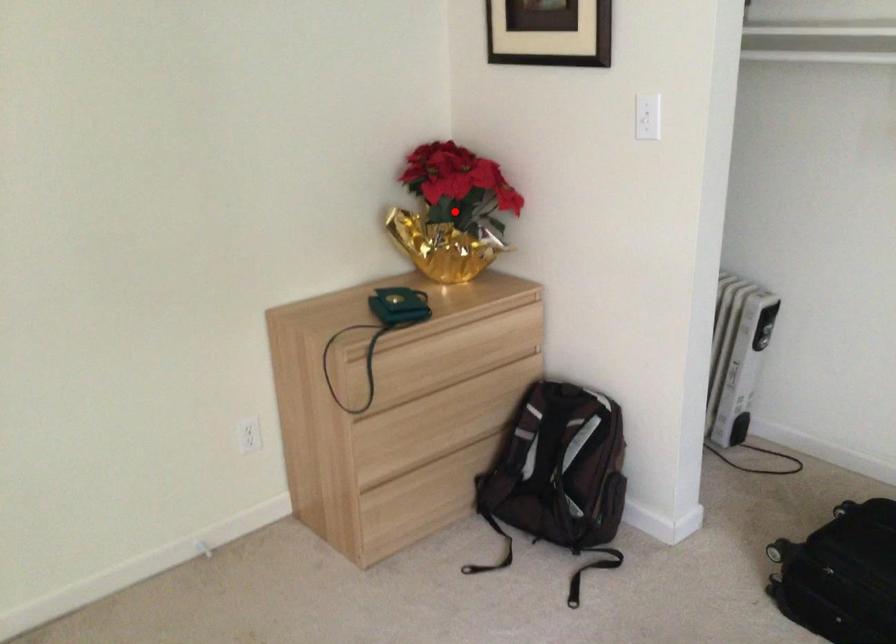
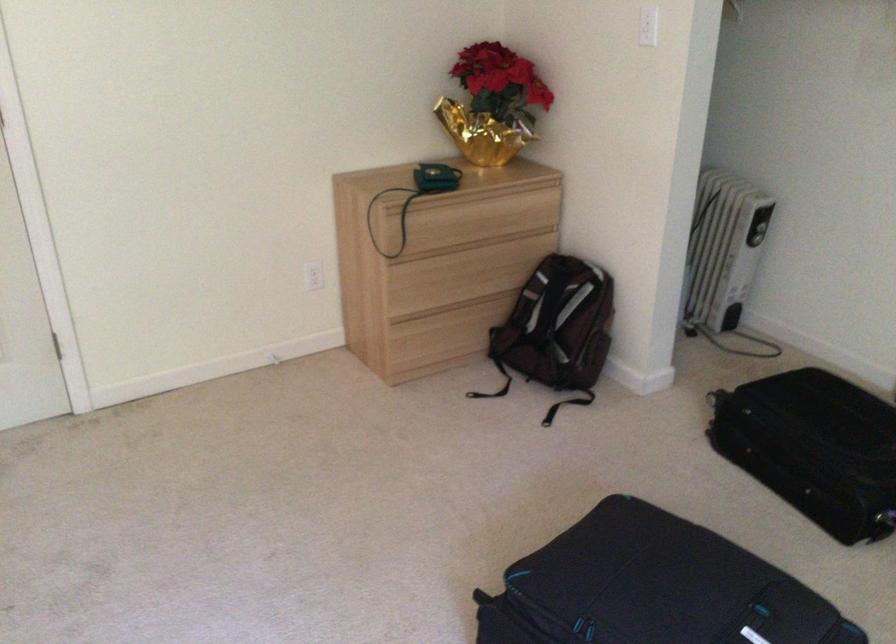
Question: I am providing you with two images of the same scene from different viewpoints. In image1, a red point is highlighted. Considering the same 3D point in image2, which of the following is correct?

Choices:
 (A) It is closer
 (B) It is farther

Answer: (B)